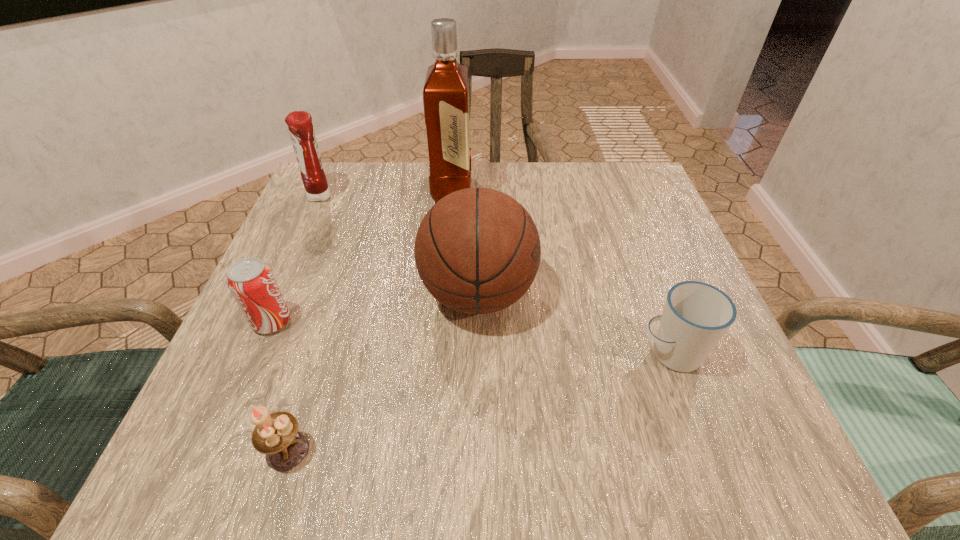
This screenshot has width=960, height=540. I want to click on the tallest object, so click(x=446, y=90).

Locate an element on the screen. The width and height of the screenshot is (960, 540). basketball is located at coordinates (477, 250).

You are a GUI agent. You are given a task and a screenshot of the screen. Output one action in this format:
    pyautogui.click(x=<x>, y=<y>)
    Task: Click on the condiment
    This screenshot has width=960, height=540.
    Given the screenshot: What is the action you would take?
    pyautogui.click(x=301, y=130)

Find the location of `soda can`. soda can is located at coordinates (252, 283).

Image resolution: width=960 pixels, height=540 pixels. In order to click on cup in this screenshot , I will do `click(696, 315)`.

This screenshot has width=960, height=540. What are the coordinates of `the fourth object from right to left` in the screenshot? It's located at (276, 435).

Where is `the nearest object`? The height and width of the screenshot is (540, 960). the nearest object is located at coordinates (276, 435).

In order to click on vacant space located 0.170m on the front label of the liquor in this screenshot , I will do `click(542, 190)`.

Locate an element on the screen. vacant position located 0.200m on the side with brand label of the basketball is located at coordinates (642, 294).

At what (x,y) coordinates should I click in order to perform the action: click on free location located 0.140m on the front of the condiment. Please return your answer as a coordinate pair (x, y). This screenshot has width=960, height=540. Looking at the image, I should click on (298, 247).